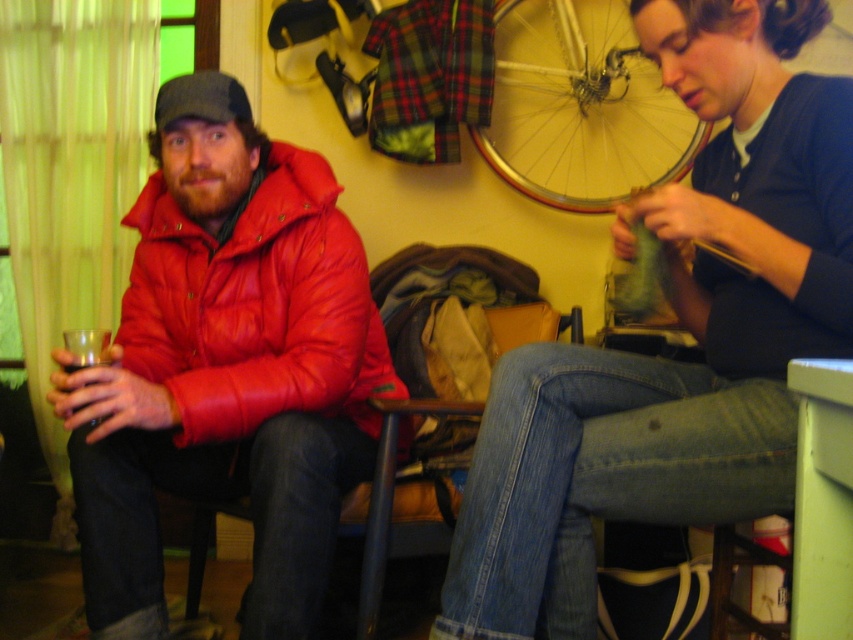
You are a fashion designer observing the image. You need to determine which item is shorter between the denim jeans at center and the matte red jacket at left. Which one is shorter?

The denim jeans at center has a lesser height compared to the matte red jacket at left, so the denim jeans at center is shorter.

You are standing in the room and want to hand a gift to the person wearing the denim jeans at center. To reach them, you need to pass by the matte red puffer jacket at left. Based on their positions, will you have to go around the jacket to reach the jeans?

The denim jeans at center is located below the matte red puffer jacket at left, so you will have to go around the matte red puffer jacket at left to reach the denim jeans at center since it is positioned lower and directly beneath it.